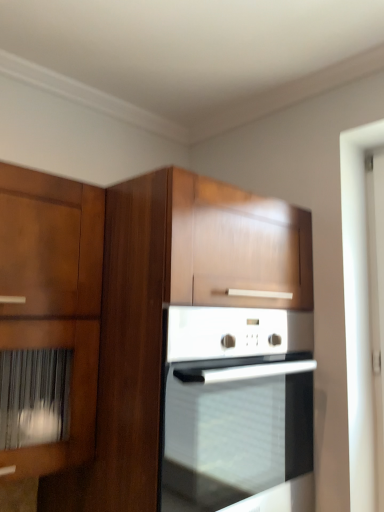
The image size is (384, 512). In order to click on white glossy screen door at right in this screenshot , I will do `click(376, 304)`.

Image resolution: width=384 pixels, height=512 pixels. What do you see at coordinates (237, 410) in the screenshot? I see `white glossy oven at center` at bounding box center [237, 410].

The width and height of the screenshot is (384, 512). I want to click on wooden cabinet at center, so click(163, 340).

Is white glossy screen door at right not near wooden cabinet at center?

No, white glossy screen door at right is not far from wooden cabinet at center.

Relative to wooden cabinet at center, is white glossy screen door at right in front or behind?

In the image, white glossy screen door at right appears behind wooden cabinet at center.

Where is `cabinetry that appears on the left of white glossy screen door at right`? Image resolution: width=384 pixels, height=512 pixels. cabinetry that appears on the left of white glossy screen door at right is located at coordinates (163, 340).

Is wooden cabinet at center at the back of white glossy screen door at right?

No.

Between white glossy screen door at right and white glossy oven at center, which one appears on the left side from the viewer's perspective?

Positioned to the left is white glossy oven at center.

Which is further, (372, 317) or (183, 319)?

Point (372, 317)

Considering the relative sizes of white glossy screen door at right and white glossy oven at center in the image provided, is white glossy screen door at right wider than white glossy oven at center?

→ No.

Find the location of a particular element. The image size is (384, 512). oven that appears on the right of wooden cabinet at center is located at coordinates (237, 410).

Would you say white glossy oven at center is a long distance from wooden cabinet at center?

No, white glossy oven at center is not far from wooden cabinet at center.

Can you confirm if white glossy oven at center is wider than wooden cabinet at center?

Indeed, white glossy oven at center has a greater width compared to wooden cabinet at center.

From the image's perspective, is white glossy oven at center below white glossy screen door at right?

Yes, from the image's perspective, white glossy oven at center is below white glossy screen door at right.

You are a GUI agent. You are given a task and a screenshot of the screen. Output one action in this format:
    pyautogui.click(x=<x>, y=<y>)
    Task: Click on the screen door above the white glossy oven at center (from a real-world perspective)
    The width and height of the screenshot is (384, 512).
    Given the screenshot: What is the action you would take?
    pyautogui.click(x=376, y=304)

Looking at the image, does white glossy oven at center seem bigger or smaller compared to white glossy screen door at right?

In the image, white glossy oven at center appears to be larger than white glossy screen door at right.

From the image's perspective, which one is positioned higher, wooden cabinet at center or white glossy screen door at right?

From the image's view, white glossy screen door at right is above.

Looking at this image, does wooden cabinet at center touch white glossy screen door at right?

No, wooden cabinet at center is not in contact with white glossy screen door at right.

Is point (290, 268) positioned behind point (382, 472)?

That is False.

Is wooden cabinet at center bigger than white glossy screen door at right?

Indeed, wooden cabinet at center has a larger size compared to white glossy screen door at right.

Which is less distant, (182, 410) or (166, 321)?

The point (166, 321) is more forward.

Looking at their sizes, would you say wooden cabinet at center is wider or thinner than white glossy oven at center?

wooden cabinet at center is thinner than white glossy oven at center.

I want to click on cabinetry that is above the white glossy oven at center (from a real-world perspective), so click(x=163, y=340).

Is wooden cabinet at center to the right of white glossy oven at center from the viewer's perspective?

No.

Find the location of a particular element. Image resolution: width=384 pixels, height=512 pixels. cabinetry on the left side of white glossy screen door at right is located at coordinates (163, 340).

Find the location of `oven below the white glossy screen door at right (from a real-world perspective)`. oven below the white glossy screen door at right (from a real-world perspective) is located at coordinates (237, 410).

Based on the photo, which object lies further to the anchor point white glossy oven at center, wooden cabinet at center or white glossy screen door at right?

Among the two, white glossy screen door at right is located further to white glossy oven at center.

When comparing their distances from wooden cabinet at center, does white glossy screen door at right or white glossy oven at center seem further?

white glossy screen door at right lies further to wooden cabinet at center than the other object.

Based on their spatial positions, is white glossy oven at center or wooden cabinet at center further from white glossy screen door at right?

wooden cabinet at center lies further to white glossy screen door at right than the other object.

Which object lies nearer to the anchor point white glossy screen door at right, wooden cabinet at center or white glossy oven at center?

white glossy oven at center is positioned closer to the anchor white glossy screen door at right.

Estimate the real-world distances between objects in this image. Which object is closer to white glossy oven at center, white glossy screen door at right or wooden cabinet at center?

wooden cabinet at center is closer to white glossy oven at center.

Looking at the image, which one is located closer to wooden cabinet at center, white glossy oven at center or white glossy screen door at right?

white glossy oven at center lies closer to wooden cabinet at center than the other object.

At what (x,y) coordinates should I click in order to perform the action: click on oven between wooden cabinet at center and white glossy screen door at right in the horizontal direction. Please return your answer as a coordinate pair (x, y). Looking at the image, I should click on coord(237,410).